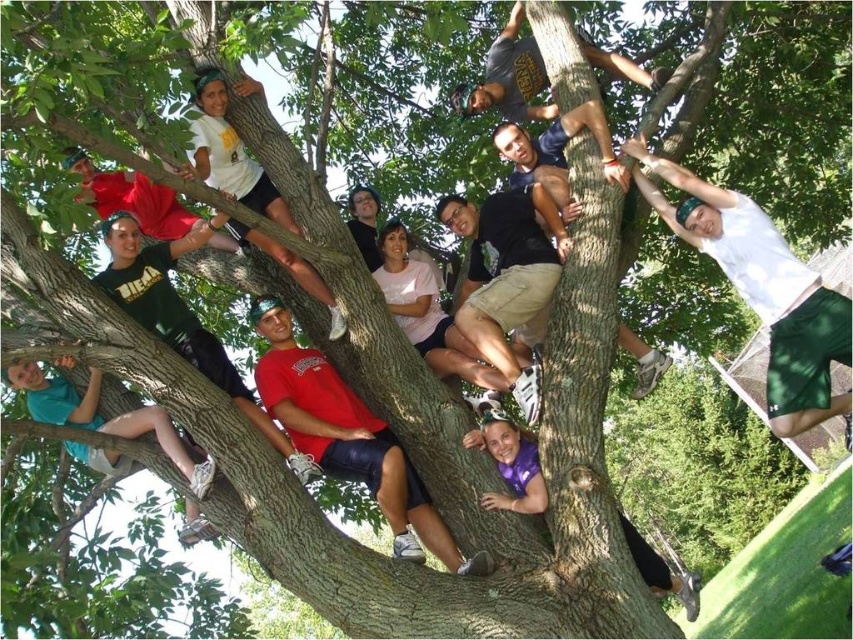
You are a photographer trying to capture a candid shot of the group in the tree. You notice a point marked at coordinates (761, 289). What object is located at this point?

The white matte shorts at upper right is located at point (761, 289).

You are a photographer trying to capture a closeup shot of both the white matte shorts at upper right and the teal matte shorts at lower left. Given their sizes, which pair of shorts will appear larger in your photo?

The white matte shorts at upper right will appear larger in the photo because its width is larger than the teal matte shorts at lower left.